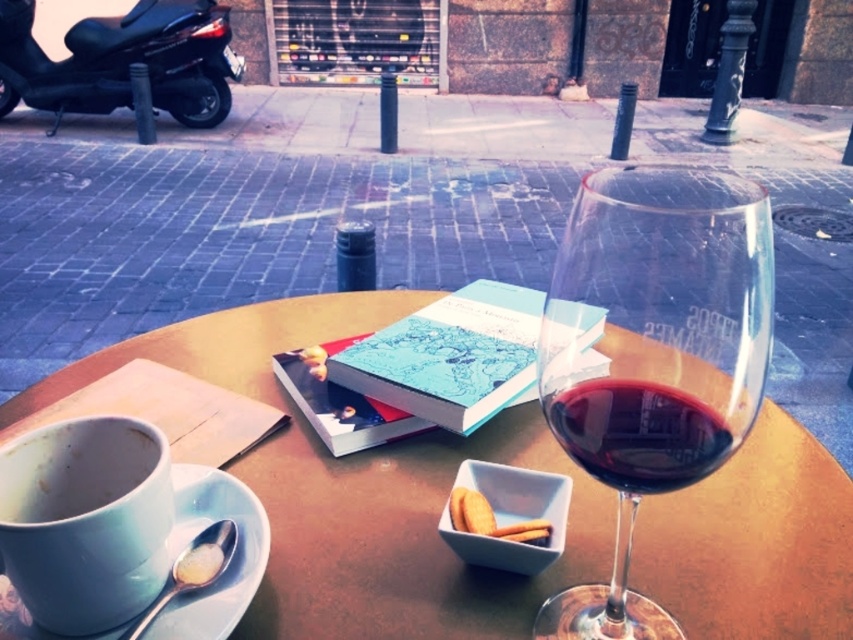
Is point (769, 531) closer to viewer compared to point (515, 522)?

No.

This screenshot has height=640, width=853. What do you see at coordinates (358, 488) in the screenshot?
I see `matte brown table at center` at bounding box center [358, 488].

I want to click on matte brown table at center, so click(x=358, y=488).

Can you confirm if matte ceramic mug at lower left is shorter than blue ceramic saucer at lower left?

Correct, matte ceramic mug at lower left is not as tall as blue ceramic saucer at lower left.

Is matte ceramic mug at lower left wider than blue ceramic saucer at lower left?

No.

Image resolution: width=853 pixels, height=640 pixels. What are the coordinates of `matte ceramic mug at lower left` in the screenshot? It's located at point(77,467).

Is black matte scooter at upper left below blue ceramic saucer at lower left?

No.

Find the location of a particular element. black matte scooter at upper left is located at coordinates (123, 60).